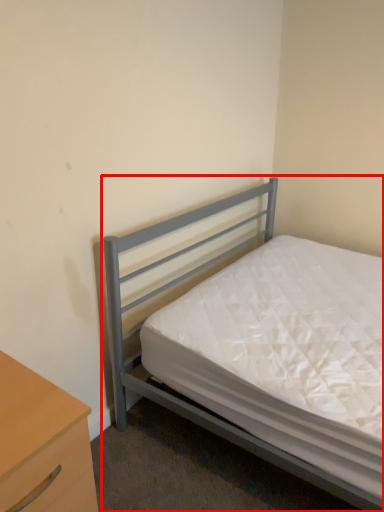
Question: From the image's perspective, what is the correct spatial positioning of bed (annotated by the red box) in reference to nightstand?

Choices:
 (A) above
 (B) below

Answer: (A)